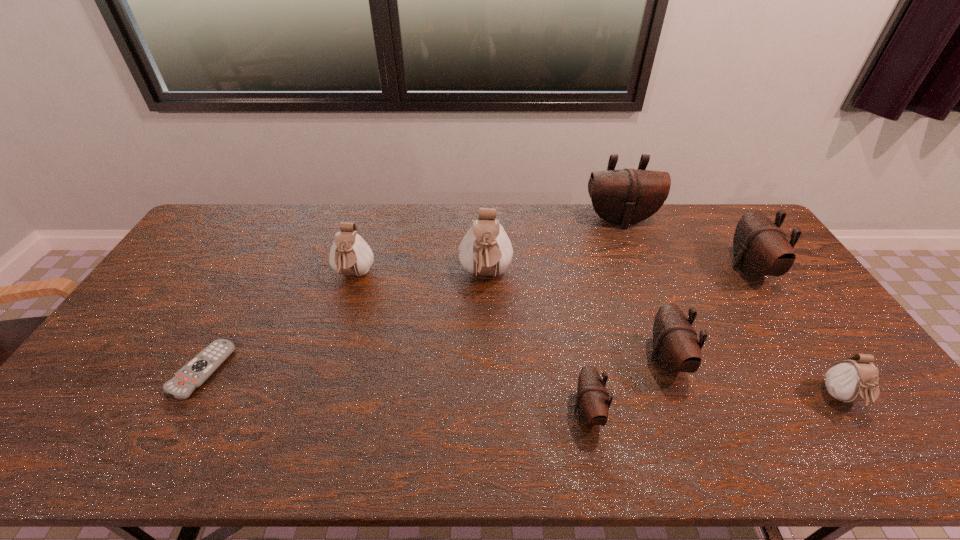
Locate which white pouch ranks second in proximity to the second object from left to right. Please provide its 2D coordinates. Your answer should be formatted as a tuple, i.e. [(x, y)], where the tuple contains the x and y coordinates of a point satisfying the conditions above.

[(852, 380)]

Point out which white pouch is positioned as the second nearest to the shortest object. Please provide its 2D coordinates. Your answer should be formatted as a tuple, i.e. [(x, y)], where the tuple contains the x and y coordinates of a point satisfying the conditions above.

[(485, 250)]

At what (x,y) coordinates should I click in order to perform the action: click on free space in the image that satisfies the following two spatial constraints: 1. on the front-facing side of the nearest white pouch; 2. with the flap open on the leftmost brown pouch. Please return your answer as a coordinate pair (x, y). Looking at the image, I should click on (851, 411).

This screenshot has width=960, height=540. What are the coordinates of `vacant area that satisfies the following two spatial constraints: 1. with the flap open on the farthest pouch; 2. with the flap open on the second smallest brown pouch` in the screenshot? It's located at (675, 360).

Identify the location of vacant position in the image that satisfies the following two spatial constraints: 1. with the flap open on the second smallest brown pouch; 2. on the front side of the shortest object. (671, 370).